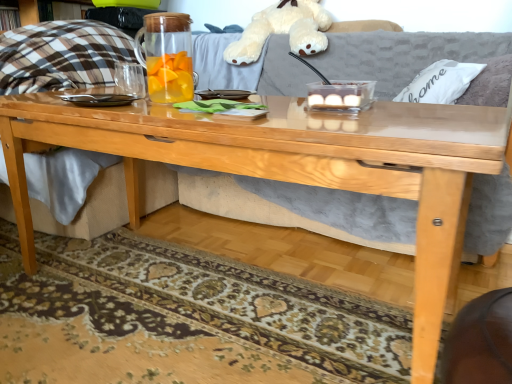
Question: Should I look upward or downward to see white plush toy at upper center?

Choices:
 (A) down
 (B) up

Answer: (B)

Question: Should I look upward or downward to see white fabric pillow at upper right?

Choices:
 (A) down
 (B) up

Answer: (B)

Question: Is white fabric pillow at upper right positioned before white plush toy at upper center?

Choices:
 (A) yes
 (B) no

Answer: (A)

Question: Is white fabric pillow at upper right taller than white plush toy at upper center?

Choices:
 (A) yes
 (B) no

Answer: (B)

Question: Would you consider white fabric pillow at upper right to be distant from white plush toy at upper center?

Choices:
 (A) yes
 (B) no

Answer: (B)

Question: Is white fabric pillow at upper right not inside white plush toy at upper center?

Choices:
 (A) yes
 (B) no

Answer: (A)

Question: Does white fabric pillow at upper right touch white plush toy at upper center?

Choices:
 (A) yes
 (B) no

Answer: (B)

Question: From a real-world perspective, is white fabric pillow at upper right below white plush toy at upper center?

Choices:
 (A) yes
 (B) no

Answer: (A)

Question: Can you confirm if transparent glass pitcher at center is smaller than patterned carpet at lower center?

Choices:
 (A) yes
 (B) no

Answer: (A)

Question: From the image's perspective, is transparent glass pitcher at center under patterned carpet at lower center?

Choices:
 (A) yes
 (B) no

Answer: (B)

Question: Is transparent glass pitcher at center to the right of patterned carpet at lower center from the viewer's perspective?

Choices:
 (A) no
 (B) yes

Answer: (B)

Question: Can you confirm if transparent glass pitcher at center is wider than patterned carpet at lower center?

Choices:
 (A) yes
 (B) no

Answer: (B)

Question: From a real-world perspective, is transparent glass pitcher at center beneath patterned carpet at lower center?

Choices:
 (A) no
 (B) yes

Answer: (A)

Question: Is the depth of transparent glass pitcher at center less than that of patterned carpet at lower center?

Choices:
 (A) no
 (B) yes

Answer: (A)

Question: Is white plush toy at upper center touching patterned carpet at lower center?

Choices:
 (A) no
 (B) yes

Answer: (A)